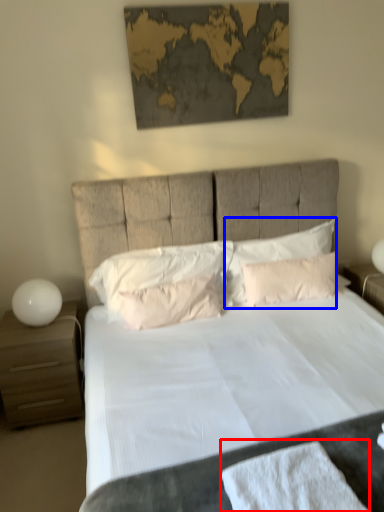
Question: Which object appears closest to the camera in this image, bath towel (highlighted by a red box) or pillow (highlighted by a blue box)?

Choices:
 (A) bath towel
 (B) pillow

Answer: (A)